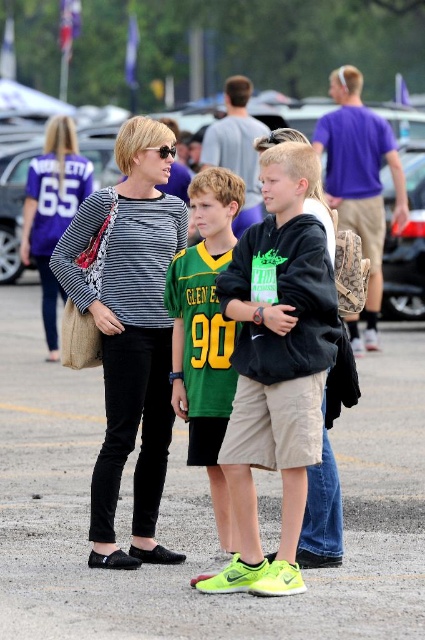
Question: Can you confirm if striped fabric shirt at center is positioned to the right of matte black backpack at center?

Choices:
 (A) yes
 (B) no

Answer: (B)

Question: Which point appears farthest from the camera in this image?

Choices:
 (A) (22, 230)
 (B) (164, 212)

Answer: (A)

Question: Is striped fabric shirt at center further to camera compared to green jersey at center?

Choices:
 (A) no
 (B) yes

Answer: (B)

Question: Which object appears closest to the camera in this image?

Choices:
 (A) green jersey at center
 (B) matte black striped shirt at center
 (C) striped fabric shirt at center
 (D) matte black backpack at center

Answer: (A)

Question: Which of these objects is positioned farthest from the striped fabric shirt at center?

Choices:
 (A) matte black backpack at center
 (B) neon green athletic shoe at center

Answer: (A)

Question: Considering the relative positions of neon green athletic shoe at center and matte black striped shirt at center in the image provided, where is neon green athletic shoe at center located with respect to matte black striped shirt at center?

Choices:
 (A) right
 (B) left

Answer: (A)